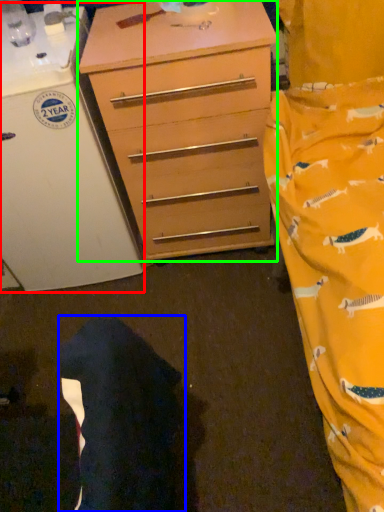
Question: Estimate the real-world distances between objects in this image. Which object is farther from appliance (highlighted by a red box), robe (highlighted by a blue box) or chest of drawers (highlighted by a green box)?

Choices:
 (A) robe
 (B) chest of drawers

Answer: (A)